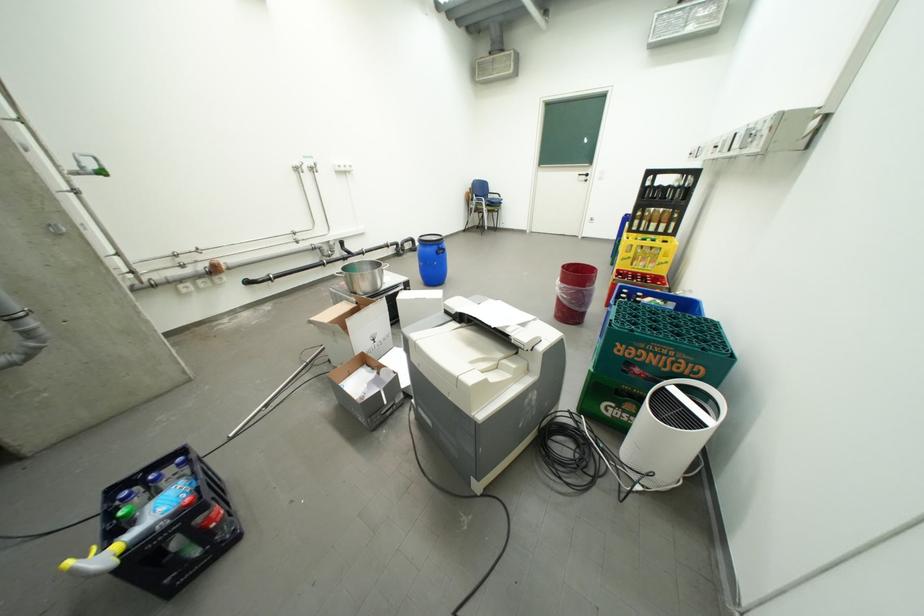
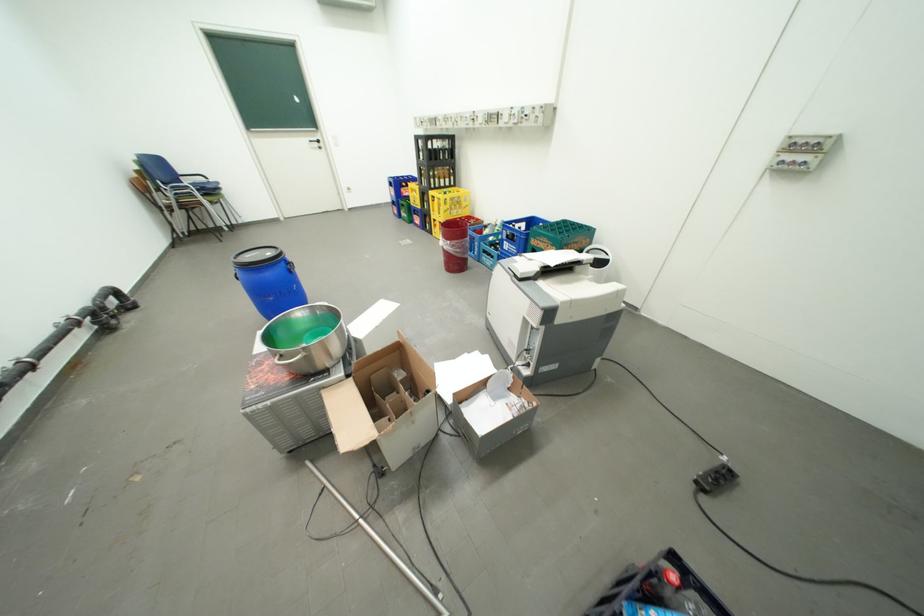
The point at (640,261) is marked in the first image. Where is the corresponding point in the second image?

(459, 212)